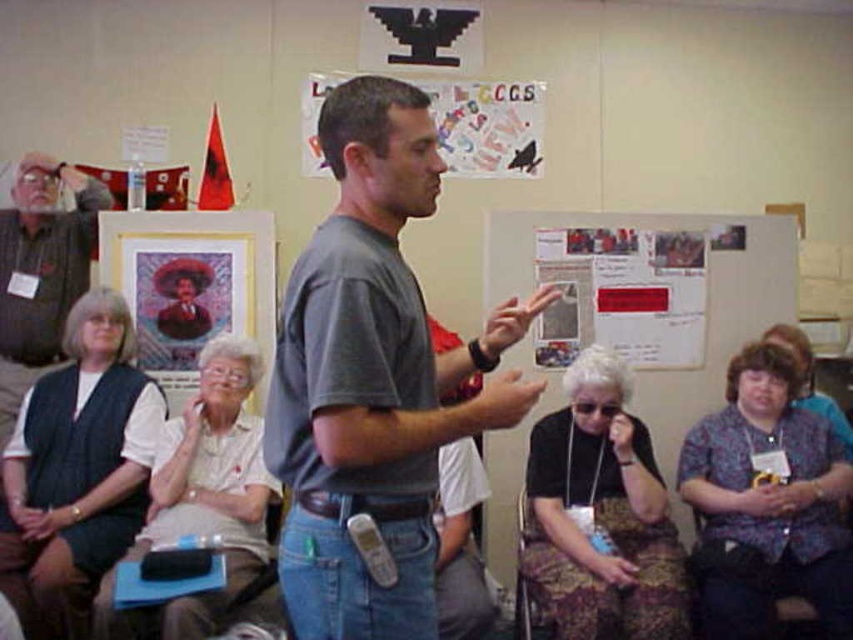
Is black fabric purse at lower right behind white fabric shirt at center?

That is True.

Can you confirm if black fabric purse at lower right is thinner than white fabric shirt at center?

Incorrect, black fabric purse at lower right's width is not less than white fabric shirt at center's.

Does point (666, 584) come closer to viewer compared to point (253, 554)?

Yes, it is in front of point (253, 554).

Locate an element on the screen. Image resolution: width=853 pixels, height=640 pixels. black fabric purse at lower right is located at coordinates (601, 516).

How much distance is there between gray matte t-shirt at center and gray flannel shirt at left?

gray matte t-shirt at center is 7.73 feet from gray flannel shirt at left.

Is gray matte t-shirt at center above gray flannel shirt at left?

Incorrect, gray matte t-shirt at center is not positioned above gray flannel shirt at left.

Is point (289, 326) in front of point (44, 337)?

Yes, it is in front of point (44, 337).

I want to click on gray matte t-shirt at center, so click(x=373, y=380).

Can you confirm if gray flannel shirt at left is wider than white paper poster at center?

In fact, gray flannel shirt at left might be narrower than white paper poster at center.

Based on the photo, does gray flannel shirt at left have a smaller size compared to white paper poster at center?

Answer: Actually, gray flannel shirt at left might be larger than white paper poster at center.

What do you see at coordinates (41, 272) in the screenshot? I see `gray flannel shirt at left` at bounding box center [41, 272].

Identify the location of gray flannel shirt at left. Image resolution: width=853 pixels, height=640 pixels. (41, 272).